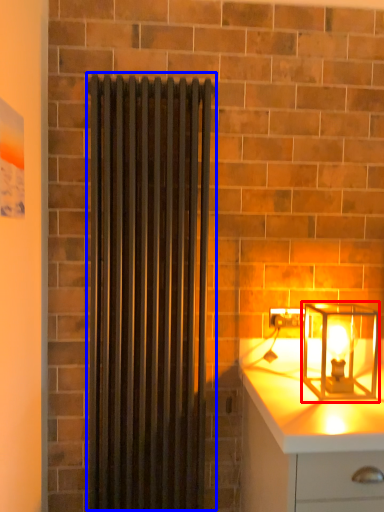
Question: Among these objects, which one is farthest to the camera, lamp (highlighted by a red box) or shower curtain (highlighted by a blue box)?

Choices:
 (A) lamp
 (B) shower curtain

Answer: (B)